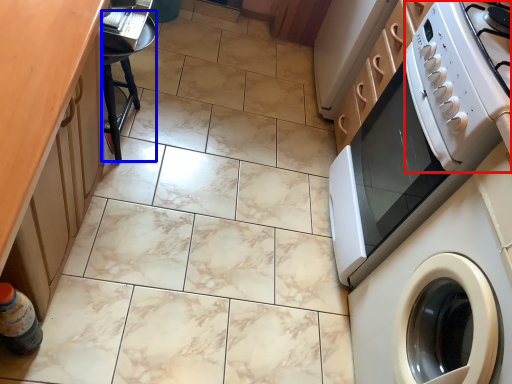
Question: Which object is further to the camera taking this photo, appliance (highlighted by a red box) or bar stool (highlighted by a blue box)?

Choices:
 (A) appliance
 (B) bar stool

Answer: (B)